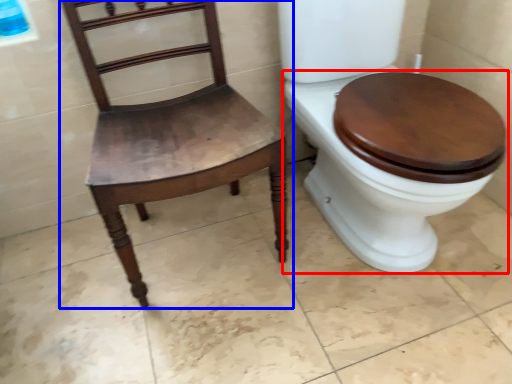
Question: Which point is closer to the camera, toilet (highlighted by a red box) or chair (highlighted by a blue box)?

Choices:
 (A) toilet
 (B) chair

Answer: (A)